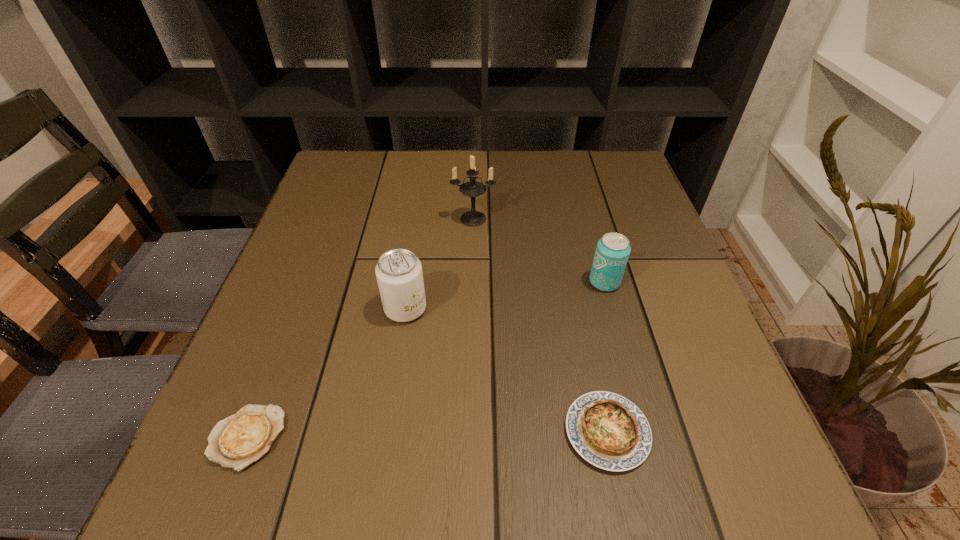
You are a GUI agent. You are given a task and a screenshot of the screen. Output one action in this format:
    pyautogui.click(x=<x>, y=<y>)
    Task: Click on the vacant space that satisfies the following two spatial constraints: 1. on the front side of the beer can; 2. on the right side of the tallest object
    
    Given the screenshot: What is the action you would take?
    point(472,282)

This screenshot has width=960, height=540. I want to click on vacant area in the image that satisfies the following two spatial constraints: 1. on the back side of the second object from left to right; 2. on the right side of the second farthest object, so click(410, 282).

Where is `vacant space that satisfies the following two spatial constraints: 1. on the back side of the soda can; 2. on the left side of the candle holder`? This screenshot has height=540, width=960. vacant space that satisfies the following two spatial constraints: 1. on the back side of the soda can; 2. on the left side of the candle holder is located at coordinates (420, 219).

Locate an element on the screen. vacant position in the image that satisfies the following two spatial constraints: 1. on the back side of the second farthest object; 2. on the right side of the right quiche is located at coordinates (575, 282).

Locate an element on the screen. free spot that satisfies the following two spatial constraints: 1. on the back side of the right quiche; 2. on the right side of the leftmost object is located at coordinates (250, 432).

The image size is (960, 540). Find the location of `blank area in the image that satisfies the following two spatial constraints: 1. on the back side of the leftmost object; 2. on the left side of the tallest object`. blank area in the image that satisfies the following two spatial constraints: 1. on the back side of the leftmost object; 2. on the left side of the tallest object is located at coordinates (332, 219).